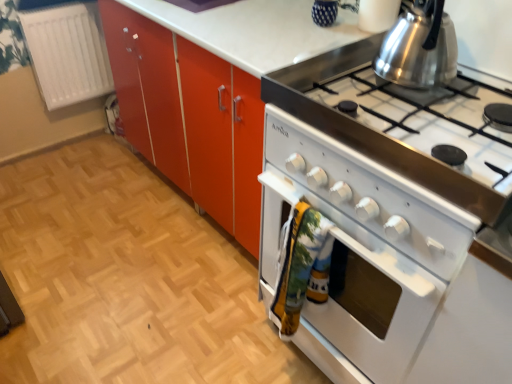
Question: Can you confirm if white glossy stove at right is positioned to the left of white glossy oven at lower right?

Choices:
 (A) yes
 (B) no

Answer: (B)

Question: Does white glossy stove at right come behind white glossy oven at lower right?

Choices:
 (A) yes
 (B) no

Answer: (B)

Question: Is white glossy stove at right wider than white glossy oven at lower right?

Choices:
 (A) yes
 (B) no

Answer: (B)

Question: From a real-world perspective, is white glossy stove at right physically above white glossy oven at lower right?

Choices:
 (A) no
 (B) yes

Answer: (B)

Question: Would you say white glossy oven at lower right is part of white glossy stove at right's contents?

Choices:
 (A) no
 (B) yes

Answer: (A)

Question: Would you say white glossy stove at right is to the left or to the right of shiny metallic kettle at upper right in the picture?

Choices:
 (A) left
 (B) right

Answer: (B)

Question: Is white glossy stove at right inside or outside of shiny metallic kettle at upper right?

Choices:
 (A) inside
 (B) outside

Answer: (B)

Question: From a real-world perspective, relative to shiny metallic kettle at upper right, is white glossy stove at right vertically above or below?

Choices:
 (A) below
 (B) above

Answer: (A)

Question: In the image, is white glossy stove at right positioned in front of or behind shiny metallic kettle at upper right?

Choices:
 (A) front
 (B) behind

Answer: (A)

Question: Considering the positions of white plastic radiator at left and white glossy oven at right in the image, is white plastic radiator at left taller or shorter than white glossy oven at right?

Choices:
 (A) tall
 (B) short

Answer: (B)

Question: Looking at their shapes, would you say white plastic radiator at left is wider or thinner than white glossy oven at right?

Choices:
 (A) wide
 (B) thin

Answer: (B)

Question: Considering their positions, is white plastic radiator at left located in front of or behind white glossy oven at right?

Choices:
 (A) front
 (B) behind

Answer: (B)

Question: Is white plastic radiator at left situated inside white glossy oven at right or outside?

Choices:
 (A) inside
 (B) outside

Answer: (B)

Question: From the image's perspective, is white glossy oven at lower right positioned above or below white plastic radiator at left?

Choices:
 (A) above
 (B) below

Answer: (B)

Question: In the image, is white glossy oven at lower right positioned in front of or behind white plastic radiator at left?

Choices:
 (A) front
 (B) behind

Answer: (A)